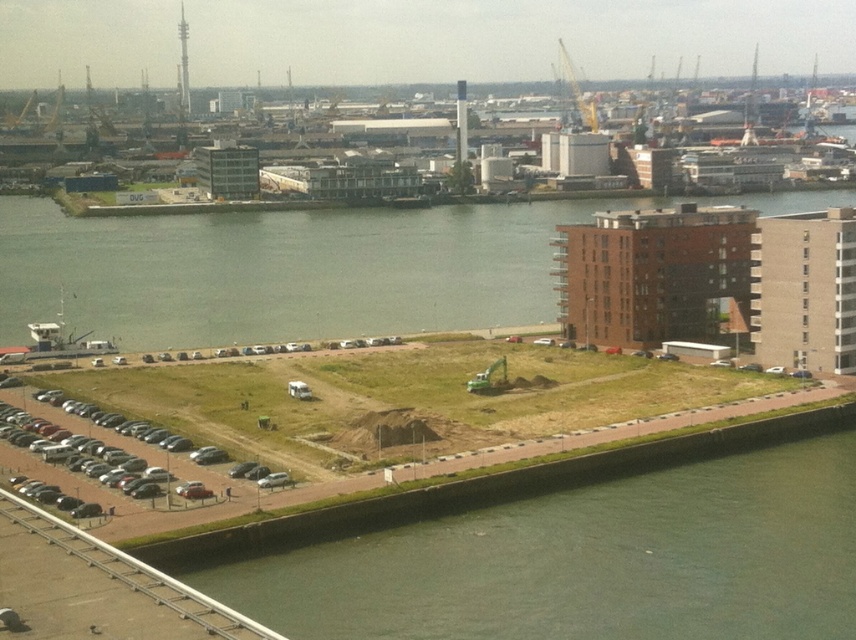
Question: Does green grass at lower left appear over green grass at lower center?

Choices:
 (A) no
 (B) yes

Answer: (A)

Question: Which point is farther to the camera?

Choices:
 (A) green grass at lower center
 (B) metallic gray cars at lower left
 (C) green grass at lower left

Answer: (A)

Question: Which of the following is the farthest from the observer?

Choices:
 (A) (122, 502)
 (B) (293, 614)
 (C) (39, 337)
 (D) (314, 316)

Answer: (D)

Question: Among these objects, which one is farthest from the camera?

Choices:
 (A) green grass at lower center
 (B) white plastic boat at lower left

Answer: (A)

Question: Can you confirm if green grass at lower left is bigger than white plastic boat at lower left?

Choices:
 (A) yes
 (B) no

Answer: (A)

Question: Is green grass at lower left positioned at the back of metallic gray cars at lower left?

Choices:
 (A) no
 (B) yes

Answer: (A)